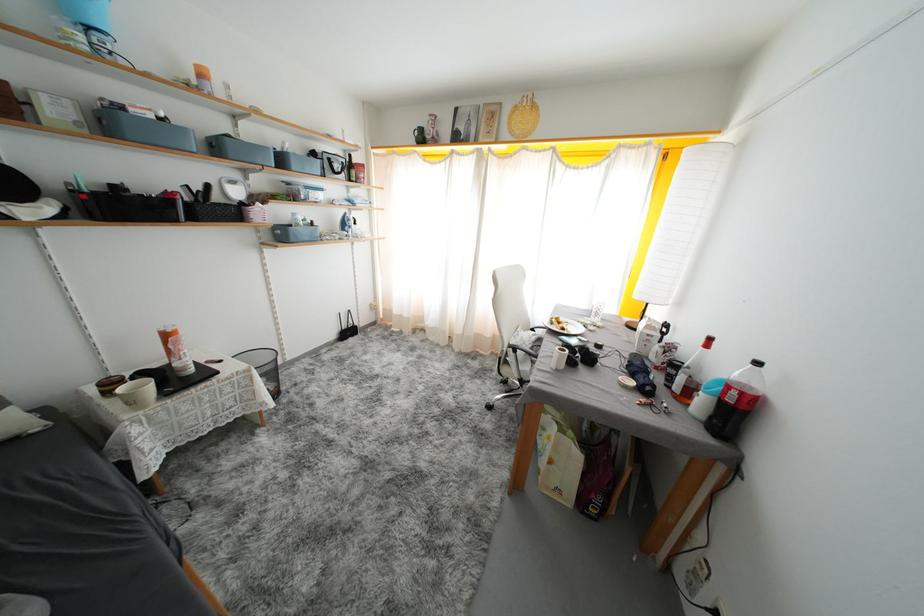
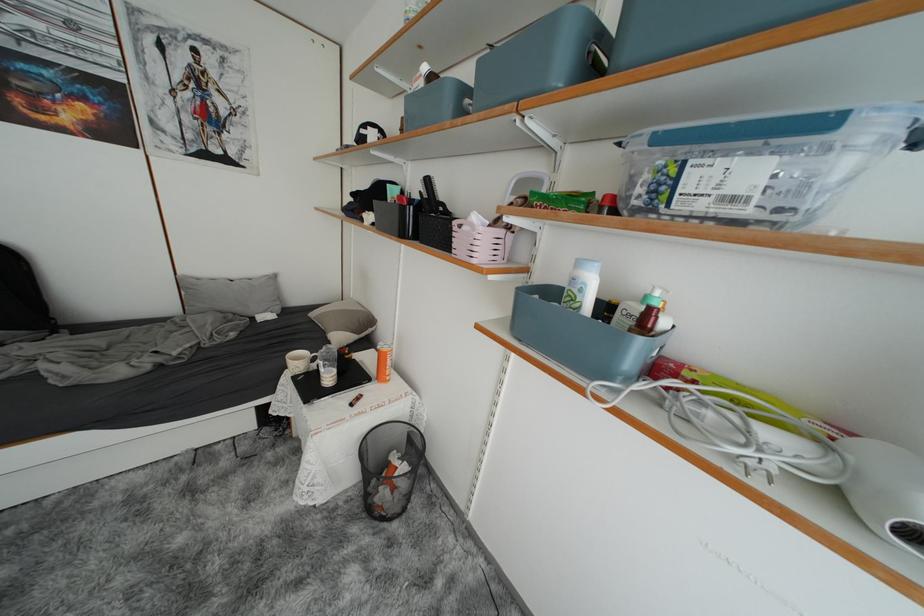
Find the pixel in the second image that matches the point at 320,204 in the first image.

(709, 209)